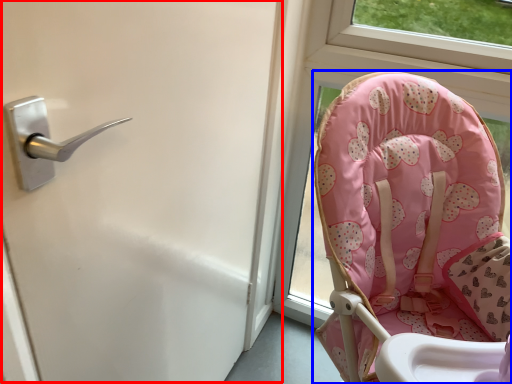
Question: Among these objects, which one is nearest to the camera, screen door (highlighted by a red box) or chair (highlighted by a blue box)?

Choices:
 (A) screen door
 (B) chair

Answer: (A)